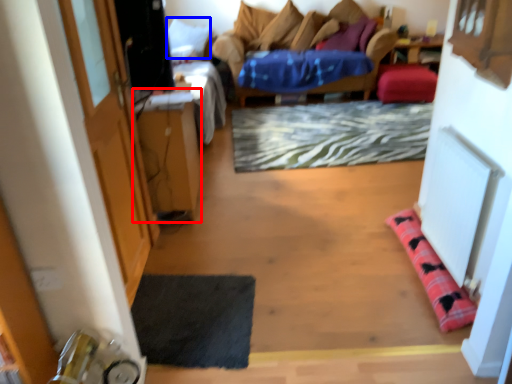
Question: Which of the following is the farthest to the observer, table (highlighted by a red box) or pillow (highlighted by a blue box)?

Choices:
 (A) table
 (B) pillow

Answer: (B)